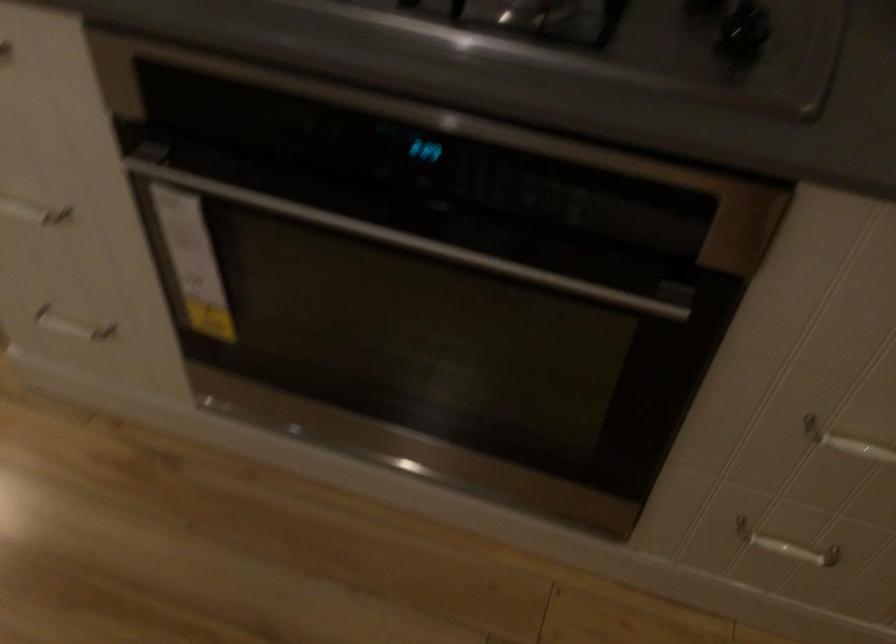
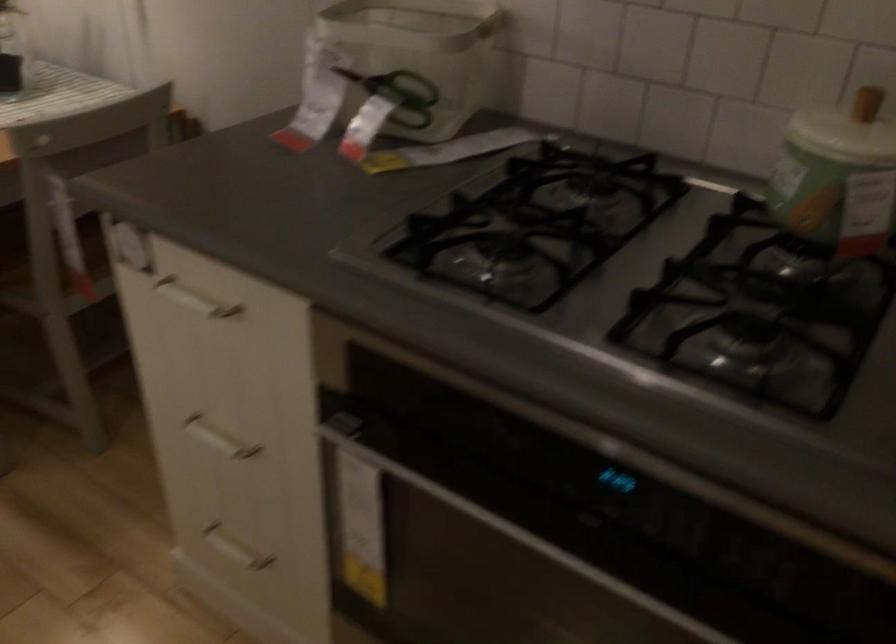
In the second image, find the point that corresponds to pixel 79 335 in the first image.

(234, 549)